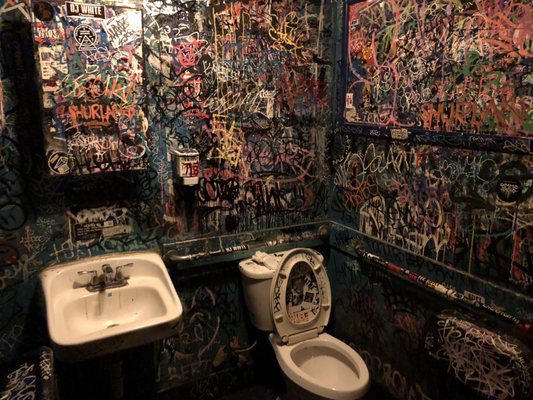
Locate an element on the screen. This screenshot has height=400, width=533. the front underside of toilet seat is located at coordinates (298, 252).